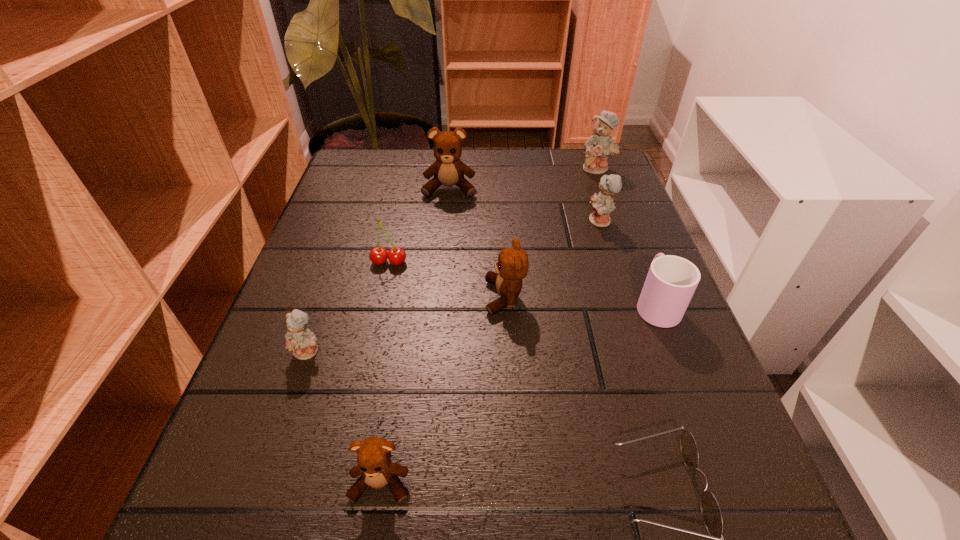
The width and height of the screenshot is (960, 540). What are the coordinates of `cherry` in the screenshot? It's located at (378, 255).

Locate an element on the screen. the nearest blue teddy bear is located at coordinates [302, 342].

Find the location of `the leftmost blue teddy bear`. the leftmost blue teddy bear is located at coordinates (302, 342).

Locate an element on the screen. This screenshot has height=540, width=960. the nearest brown teddy bear is located at coordinates (374, 460).

Where is `the smallest brown teddy bear`? the smallest brown teddy bear is located at coordinates (374, 460).

Where is `free spot located on the front-facing side of the second farthest object`? This screenshot has width=960, height=540. free spot located on the front-facing side of the second farthest object is located at coordinates (446, 217).

Where is `blank space located 0.120m on the front-facing side of the biggest blue teddy bear`? blank space located 0.120m on the front-facing side of the biggest blue teddy bear is located at coordinates (610, 202).

The image size is (960, 540). Identify the location of blank space located on the front-facing side of the third farthest teddy bear. (444, 222).

Locate an element on the screen. free location located on the front-facing side of the third farthest teddy bear is located at coordinates (529, 222).

This screenshot has height=540, width=960. In order to click on vacant space situated 0.260m on the front-facing side of the third farthest teddy bear in this screenshot , I will do `click(471, 222)`.